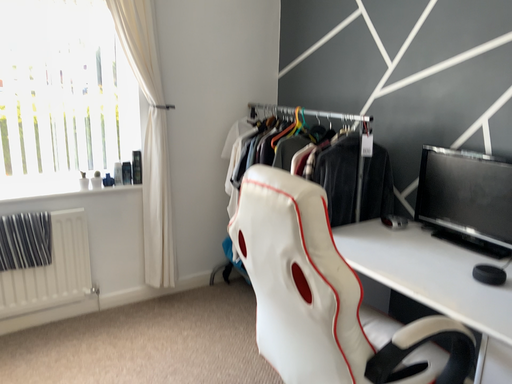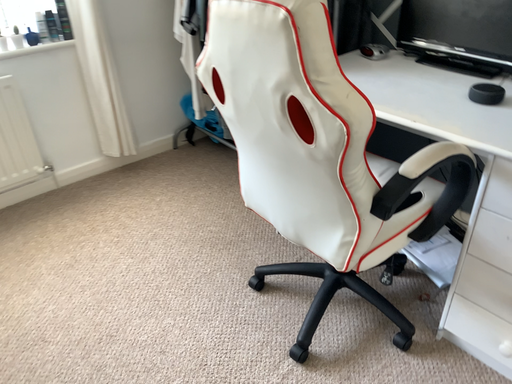
Question: Which way did the camera rotate in the video?

Choices:
 (A) rotated left
 (B) rotated right

Answer: (B)